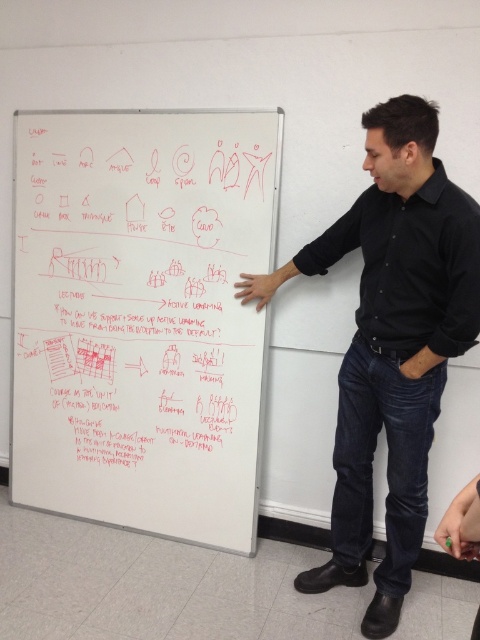
Question: Considering the relative positions of whiteboard at center and black shirt at center in the image provided, where is whiteboard at center located with respect to black shirt at center?

Choices:
 (A) right
 (B) left

Answer: (B)

Question: Considering the relative positions of whiteboard at center and black shirt at center in the image provided, where is whiteboard at center located with respect to black shirt at center?

Choices:
 (A) left
 (B) right

Answer: (A)

Question: Which of the following is the farthest from the observer?

Choices:
 (A) (176, 500)
 (B) (368, 282)

Answer: (A)

Question: Which object appears farthest from the camera in this image?

Choices:
 (A) black shirt at center
 (B) whiteboard at center

Answer: (B)

Question: Is whiteboard at center bigger than black shirt at center?

Choices:
 (A) no
 (B) yes

Answer: (B)